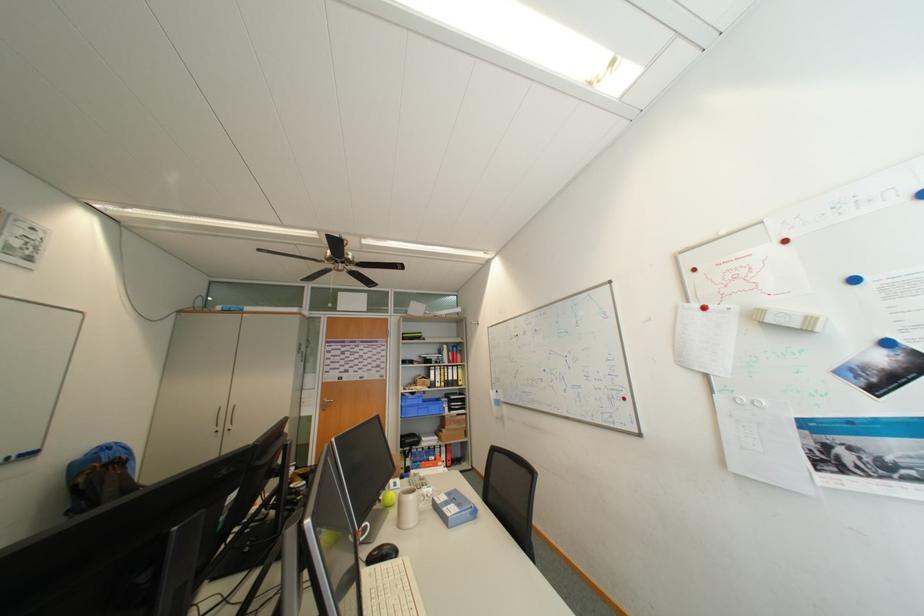
Identify the location of silver cabinet handle. (216, 419).